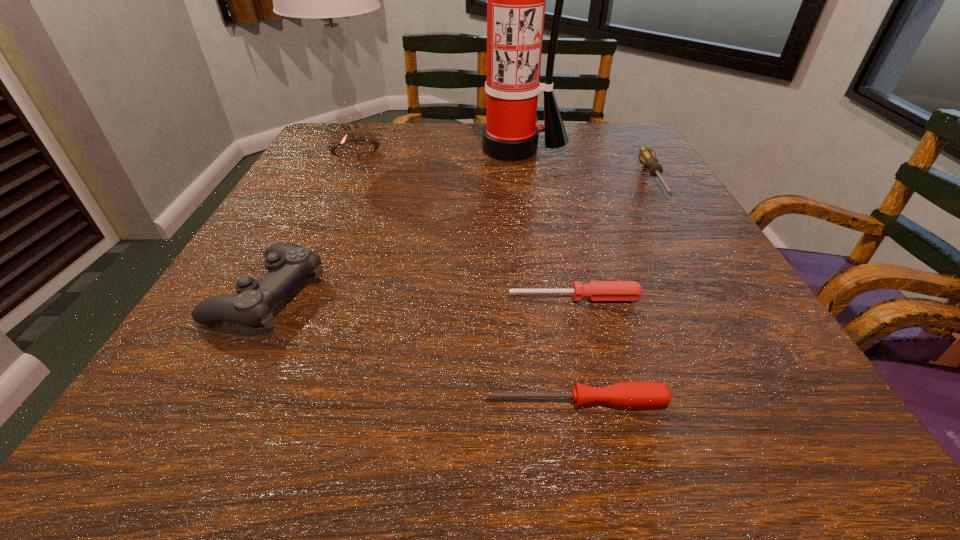
Where is `object that is the second nearest to the fifth shortest object`? This screenshot has height=540, width=960. object that is the second nearest to the fifth shortest object is located at coordinates (287, 263).

Choose which object is the second nearest neighbor to the tallest object. Please provide its 2D coordinates. Your answer should be formatted as a tuple, i.e. [(x, y)], where the tuple contains the x and y coordinates of a point satisfying the conditions above.

[(328, 0)]

Identify the location of screwdriver that stands as the second closest to the nearest object. (647, 157).

At what (x,y) coordinates should I click in order to perform the action: click on the second closest screwdriver to the second tallest object. Please return your answer as a coordinate pair (x, y). Looking at the image, I should click on (647, 157).

Identify the location of free spot that satisfies the following two spatial constraints: 1. on the front-facing side of the second tallest object; 2. on the front side of the control. The height and width of the screenshot is (540, 960). pyautogui.click(x=284, y=294).

The height and width of the screenshot is (540, 960). I want to click on free location that satisfies the following two spatial constraints: 1. on the front-facing side of the table lamp; 2. on the right side of the second farthest screwdriver, so click(283, 298).

What are the coordinates of `free space that satisfies the following two spatial constraints: 1. at the nozzle of the tallest object; 2. on the front-facing side of the table lamp` in the screenshot? It's located at (515, 149).

At what (x,y) coordinates should I click in order to perform the action: click on free space in the image that satisfies the following two spatial constraints: 1. on the front-facing side of the second tallest object; 2. on the left side of the second nearest screwdriver. Please return your answer as a coordinate pair (x, y). The width and height of the screenshot is (960, 540). Looking at the image, I should click on (283, 298).

Find the location of a particular element. Image resolution: width=960 pixels, height=540 pixels. free spot that satisfies the following two spatial constraints: 1. on the front side of the second farthest screwdriver; 2. at the tip of the nearest object is located at coordinates (599, 402).

The width and height of the screenshot is (960, 540). I want to click on free location that satisfies the following two spatial constraints: 1. at the tip of the rightmost object; 2. at the tip of the nearest object, so click(789, 402).